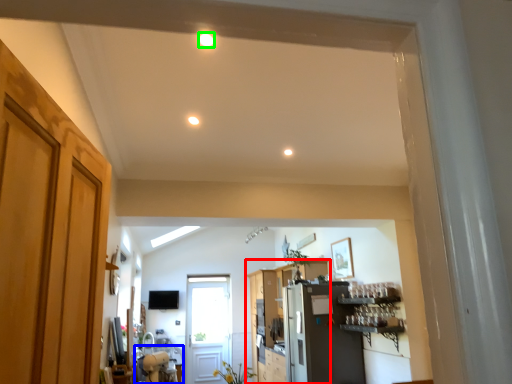
Question: Which is nearer to the cabinetry (highlighted by a red box)? table (highlighted by a blue box) or lighting (highlighted by a green box).

Choices:
 (A) table
 (B) lighting

Answer: (A)